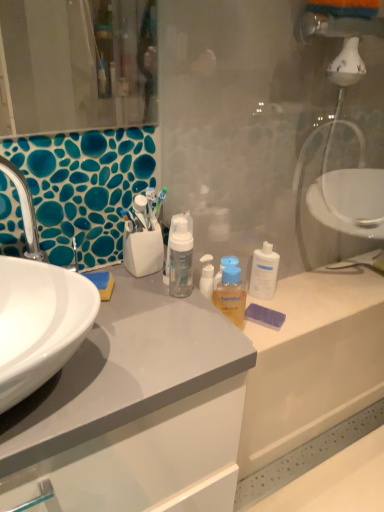
Image resolution: width=384 pixels, height=512 pixels. What do you see at coordinates (39, 324) in the screenshot? I see `white glossy sink at left` at bounding box center [39, 324].

This screenshot has height=512, width=384. Describe the element at coordinates (231, 295) in the screenshot. I see `translucent orange liquid at center` at that location.

Image resolution: width=384 pixels, height=512 pixels. In order to click on translucent orange liquid at center in this screenshot , I will do `click(231, 295)`.

In order to click on transparent plastic glass door at center in this screenshot , I will do `click(274, 125)`.

Is translucent orange liquid at center at the left side of transparent plastic glass door at center?

Indeed, translucent orange liquid at center is positioned on the left side of transparent plastic glass door at center.

From a real-world perspective, does translucent orange liquid at center sit lower than transparent plastic glass door at center?

Yes.

At what (x,y) coordinates should I click in order to perform the action: click on mouthwash lying above the transparent plastic glass door at center (from the image's perspective). Please return your answer as a coordinate pair (x, y). This screenshot has height=512, width=384. Looking at the image, I should click on (231, 295).

In terms of height, does translucent orange liquid at center look taller or shorter compared to transparent plastic glass door at center?

Considering their sizes, translucent orange liquid at center has less height than transparent plastic glass door at center.

Considering the sizes of transparent plastic bottle at center and white glossy sink at left in the image, is transparent plastic bottle at center wider or thinner than white glossy sink at left?

In the image, transparent plastic bottle at center appears to be more narrow than white glossy sink at left.

From the image's perspective, is transparent plastic bottle at center on top of white glossy sink at left?

Actually, transparent plastic bottle at center appears below white glossy sink at left in the image.

Is transparent plastic bottle at center taller than white glossy sink at left?

In fact, transparent plastic bottle at center may be shorter than white glossy sink at left.

From a real-world perspective, is transparent plastic bottle at center beneath white glossy sink at left?

Indeed, from a real-world perspective, transparent plastic bottle at center is positioned beneath white glossy sink at left.

Can you confirm if white glossy sink at left is positioned to the right of translucent orange liquid at center?

No.

Is white glossy sink at left behind translucent orange liquid at center?

No, white glossy sink at left is in front of translucent orange liquid at center.

From a real-world perspective, is white glossy sink at left positioned under translucent orange liquid at center based on gravity?

No, from a real-world perspective, white glossy sink at left is not below translucent orange liquid at center.

I want to click on mouthwash below the white glossy sink at left (from the image's perspective), so click(x=231, y=295).

From a real-world perspective, which object rests below the other?

In real-world perspective, transparent plastic glass door at center is lower.

Considering the positions of point (33, 276) and point (188, 67), is point (33, 276) closer or farther from the camera than point (188, 67)?

Point (33, 276) is closer to the camera than point (188, 67).

Where is `glass door lying on the right of white glossy sink at left`? The image size is (384, 512). glass door lying on the right of white glossy sink at left is located at coordinates (274, 125).

Are white glossy sink at left and transparent plastic glass door at center beside each other?

No, white glossy sink at left is not with transparent plastic glass door at center.

Considering the sizes of objects translucent orange liquid at center and white glossy sink at left in the image provided, who is shorter, translucent orange liquid at center or white glossy sink at left?

Standing shorter between the two is translucent orange liquid at center.

Is translucent orange liquid at center further to the viewer compared to white glossy sink at left?

Yes, translucent orange liquid at center is behind white glossy sink at left.

Is translucent orange liquid at center with white glossy sink at left?

They are not placed beside each other.

Considering the positions of points (346, 67) and (230, 271), is point (346, 67) closer to camera compared to point (230, 271)?

Yes, point (346, 67) is closer to viewer.

Which object is positioned more to the left, transparent plastic glass door at center or translucent orange liquid at center?

Positioned to the left is translucent orange liquid at center.

Would you say transparent plastic glass door at center is inside or outside translucent orange liquid at center?

transparent plastic glass door at center is not enclosed by translucent orange liquid at center.

Measure the distance from transparent plastic glass door at center to translucent orange liquid at center.

They are 14.83 inches apart.

Could you tell me if transparent plastic glass door at center is facing transparent plastic bottle at center?

Yes, transparent plastic glass door at center is turned towards transparent plastic bottle at center.

Between transparent plastic glass door at center and transparent plastic bottle at center, which one has larger size?

Bigger between the two is transparent plastic glass door at center.

Would you say transparent plastic glass door at center is inside or outside transparent plastic bottle at center?

transparent plastic glass door at center cannot be found inside transparent plastic bottle at center.

From a real-world perspective, between transparent plastic glass door at center and transparent plastic bottle at center, who is vertically higher?

From a 3D spatial view, transparent plastic glass door at center is above.

At what (x,y) coordinates should I click in order to perform the action: click on glass door located on the right of translucent orange liquid at center. Please return your answer as a coordinate pair (x, y). This screenshot has width=384, height=512. Looking at the image, I should click on (274, 125).

The image size is (384, 512). I want to click on cleaning product below the white glossy sink at left (from the image's perspective), so click(x=264, y=272).

Estimate the real-world distances between objects in this image. Which object is further from transparent plastic glass door at center, white glossy sink at left or translucent orange liquid at center?

The object further to transparent plastic glass door at center is white glossy sink at left.

Looking at the image, which one is located closer to white glossy sink at left, transparent plastic bottle at center or translucent orange liquid at center?

The object closer to white glossy sink at left is translucent orange liquid at center.

Estimate the real-world distances between objects in this image. Which object is further from white glossy sink at left, translucent orange liquid at center or transparent plastic glass door at center?

Among the two, transparent plastic glass door at center is located further to white glossy sink at left.

From the image, which object appears to be nearer to white glossy sink at left, translucent orange liquid at center or transparent plastic bottle at center?

The object closer to white glossy sink at left is translucent orange liquid at center.

When comparing their distances from transparent plastic bottle at center, does white glossy sink at left or transparent plastic glass door at center seem closer?

transparent plastic glass door at center lies closer to transparent plastic bottle at center than the other object.

Looking at the image, which one is located closer to white glossy sink at left, transparent plastic bottle at center or transparent plastic glass door at center?

transparent plastic glass door at center.

When comparing their distances from transparent plastic glass door at center, does translucent orange liquid at center or transparent plastic bottle at center seem closer?

transparent plastic bottle at center is positioned closer to the anchor transparent plastic glass door at center.

Which object lies further to the anchor point translucent orange liquid at center, transparent plastic bottle at center or white glossy sink at left?

Among the two, white glossy sink at left is located further to translucent orange liquid at center.

Where is `sink between transparent plastic glass door at center and translucent orange liquid at center in the front-back direction`? sink between transparent plastic glass door at center and translucent orange liquid at center in the front-back direction is located at coordinates (39, 324).

At what (x,y) coordinates should I click in order to perform the action: click on mouthwash between white glossy sink at left and transparent plastic bottle at center along the z-axis. Please return your answer as a coordinate pair (x, y). This screenshot has width=384, height=512. Looking at the image, I should click on (231, 295).

Locate an element on the screen. The height and width of the screenshot is (512, 384). sink between transparent plastic glass door at center and transparent plastic bottle at center from front to back is located at coordinates (39, 324).

You are a GUI agent. You are given a task and a screenshot of the screen. Output one action in this format:
    pyautogui.click(x=<x>, y=<y>)
    Task: Click on the mouthwash positioned between transparent plastic glass door at center and transparent plastic bottle at center from near to far
    This screenshot has height=512, width=384.
    Given the screenshot: What is the action you would take?
    pyautogui.click(x=231, y=295)